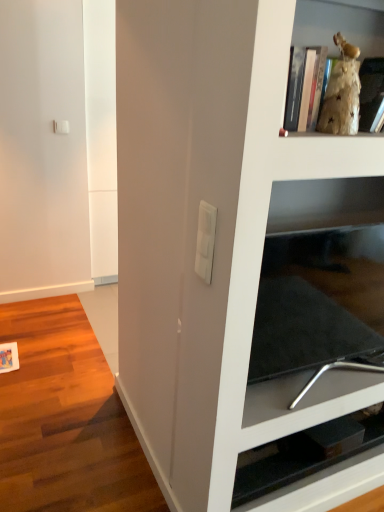
In order to face gold textured figurine at upper right, the second shelf ordered from the bottom, should I rotate leftwards or rightwards?

You should rotate right by 20.167 degrees.

Image resolution: width=384 pixels, height=512 pixels. In order to click on black glossy tv stand at lower right, marked as the 1th shelf in a back-to-front arrangement in this screenshot , I will do `click(297, 466)`.

This screenshot has width=384, height=512. Identify the location of gold textured figurine at upper right, the second shelf ordered from the bottom. (338, 26).

Based on the photo, is white plastic light switch at center positioned beyond the bounds of black glossy tv stand at lower right, marked as the 1th shelf in a back-to-front arrangement?

That's correct, white plastic light switch at center is outside of black glossy tv stand at lower right, marked as the 1th shelf in a back-to-front arrangement.

Looking at this image, from a real-world perspective, is white plastic light switch at center above or below black glossy tv stand at lower right, marked as the first shelf in a bottom-to-top arrangement?

white plastic light switch at center is above black glossy tv stand at lower right, marked as the first shelf in a bottom-to-top arrangement.

Considering the relative sizes of white plastic light switch at center and black glossy tv stand at lower right, the 2th shelf when ordered from top to bottom, in the image provided, is white plastic light switch at center taller than black glossy tv stand at lower right, the 2th shelf when ordered from top to bottom,?

Yes, white plastic light switch at center is taller than black glossy tv stand at lower right, the 2th shelf when ordered from top to bottom.

Considering the positions of points (202, 232) and (330, 470), is point (202, 232) farther from camera compared to point (330, 470)?

No, it is not.

Is black glossy tv stand at lower right, marked as the 1th shelf in a back-to-front arrangement, behind gold textured figurine at upper right, the second shelf from the back?

Yes, black glossy tv stand at lower right, marked as the 1th shelf in a back-to-front arrangement, is behind gold textured figurine at upper right, the second shelf from the back.

Does point (262, 460) come farther from viewer compared to point (310, 3)?

Yes, it is.

From the image's perspective, which is above, black glossy tv stand at lower right, marked as the 1th shelf in a back-to-front arrangement, or gold textured figurine at upper right, the second shelf ordered from the bottom?

gold textured figurine at upper right, the second shelf ordered from the bottom.

Considering their positions, is gold textured figurine at upper right, which appears as the 1th shelf when viewed from the front, located in front of or behind black glossy tv stand at lower right, the 2th shelf when ordered from top to bottom?

gold textured figurine at upper right, which appears as the 1th shelf when viewed from the front, is in front of black glossy tv stand at lower right, the 2th shelf when ordered from top to bottom.

Is point (353, 33) in front of point (290, 482)?

Yes.

From the image's perspective, is gold textured figurine at upper right, the second shelf from the back, above or below black glossy tv stand at lower right, the second shelf from the front?

gold textured figurine at upper right, the second shelf from the back, is above black glossy tv stand at lower right, the second shelf from the front.

Is black glossy tv stand at lower right, the 2th shelf when ordered from top to bottom, wider than white plastic light switch at center?

Yes.

From their relative heights in the image, would you say black glossy tv stand at lower right, marked as the 1th shelf in a back-to-front arrangement, is taller or shorter than white plastic light switch at center?

black glossy tv stand at lower right, marked as the 1th shelf in a back-to-front arrangement, is shorter than white plastic light switch at center.

Is white plastic light switch at center inside black glossy tv stand at lower right, marked as the first shelf in a bottom-to-top arrangement?

No.

Who is smaller, black glossy tv stand at lower right, marked as the first shelf in a bottom-to-top arrangement, or white plastic light switch at center?

white plastic light switch at center is smaller.

Would you say white plastic light switch at center contains gold textured figurine at upper right, the second shelf from the back?

Actually, gold textured figurine at upper right, the second shelf from the back, is outside white plastic light switch at center.

Between white plastic light switch at center and gold textured figurine at upper right, the second shelf ordered from the bottom, which one has larger width?

Wider between the two is gold textured figurine at upper right, the second shelf ordered from the bottom.

Identify the location of light switch that appears below the gold textured figurine at upper right, the second shelf ordered from the bottom (from a real-world perspective). (205, 241).

Which object is positioned more to the left, gold textured figurine at upper right, the second shelf from the back, or white plastic light switch at center?

white plastic light switch at center.

Which of these two, gold textured figurine at upper right, the second shelf ordered from the bottom, or white plastic light switch at center, stands taller?

With more height is gold textured figurine at upper right, the second shelf ordered from the bottom.

Between gold textured figurine at upper right, the second shelf from the back, and white plastic light switch at center, which one is positioned in front?

Positioned in front is gold textured figurine at upper right, the second shelf from the back.

Is gold textured figurine at upper right, placed as the first shelf when sorted from top to bottom, not near white plastic light switch at center?

No, there isn't a large distance between gold textured figurine at upper right, placed as the first shelf when sorted from top to bottom, and white plastic light switch at center.

Image resolution: width=384 pixels, height=512 pixels. I want to click on shelf below the white plastic light switch at center (from a real-world perspective), so click(x=297, y=466).

Find the location of a particular element. This screenshot has width=384, height=512. shelf that is on the left side of black glossy tv stand at lower right, marked as the 1th shelf in a back-to-front arrangement is located at coordinates (338, 26).

Based on their spatial positions, is black glossy tv stand at lower right, marked as the first shelf in a bottom-to-top arrangement, or white plastic light switch at center closer to gold textured figurine at upper right, placed as the first shelf when sorted from top to bottom?

white plastic light switch at center is positioned closer to the anchor gold textured figurine at upper right, placed as the first shelf when sorted from top to bottom.

Looking at this image, estimate the real-world distances between objects in this image. Which object is further from white plastic light switch at center, black glossy tv stand at lower right, marked as the 1th shelf in a back-to-front arrangement, or gold textured figurine at upper right, placed as the first shelf when sorted from top to bottom?

black glossy tv stand at lower right, marked as the 1th shelf in a back-to-front arrangement.

From the image, which object appears to be farther from gold textured figurine at upper right, placed as the first shelf when sorted from top to bottom, white plastic light switch at center or black glossy tv stand at lower right, the 2th shelf when ordered from top to bottom?

black glossy tv stand at lower right, the 2th shelf when ordered from top to bottom, lies further to gold textured figurine at upper right, placed as the first shelf when sorted from top to bottom, than the other object.

In the scene shown: Which object lies nearer to the anchor point black glossy tv stand at lower right, the 2th shelf when ordered from top to bottom, white plastic light switch at center or gold textured figurine at upper right, the second shelf from the back?

Among the two, white plastic light switch at center is located nearer to black glossy tv stand at lower right, the 2th shelf when ordered from top to bottom.

Which object lies nearer to the anchor point white plastic light switch at center, gold textured figurine at upper right, the second shelf from the back, or black glossy tv stand at lower right, marked as the 1th shelf in a back-to-front arrangement?

gold textured figurine at upper right, the second shelf from the back.

Considering their positions, is gold textured figurine at upper right, the second shelf ordered from the bottom, positioned closer to black glossy tv stand at lower right, the 2th shelf when ordered from top to bottom, than white plastic light switch at center?

white plastic light switch at center is positioned closer to the anchor black glossy tv stand at lower right, the 2th shelf when ordered from top to bottom.

Locate an element on the screen. This screenshot has height=512, width=384. light switch between gold textured figurine at upper right, placed as the first shelf when sorted from top to bottom, and black glossy tv stand at lower right, the 2th shelf when ordered from top to bottom, in the vertical direction is located at coordinates (205, 241).